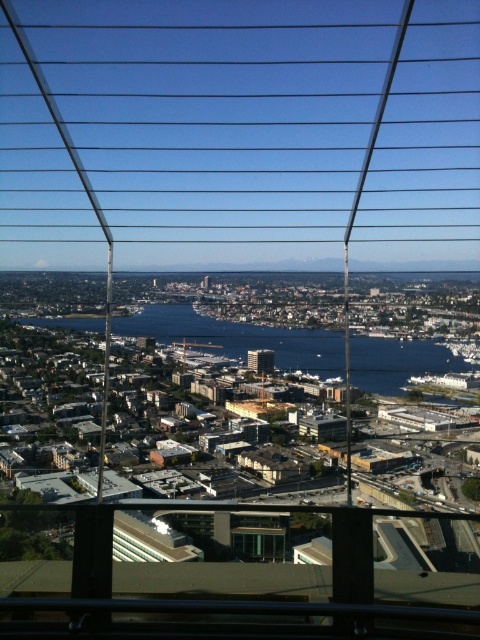
Looking at this image, you are standing at the observation deck looking out. You see two points marked in the scene. The first point is at coordinate point(235,541) and the second is at point(141,540). From your vantage point, which point appears closer to you?

Point(235,541) appears closer because it is in front of point(141,540).